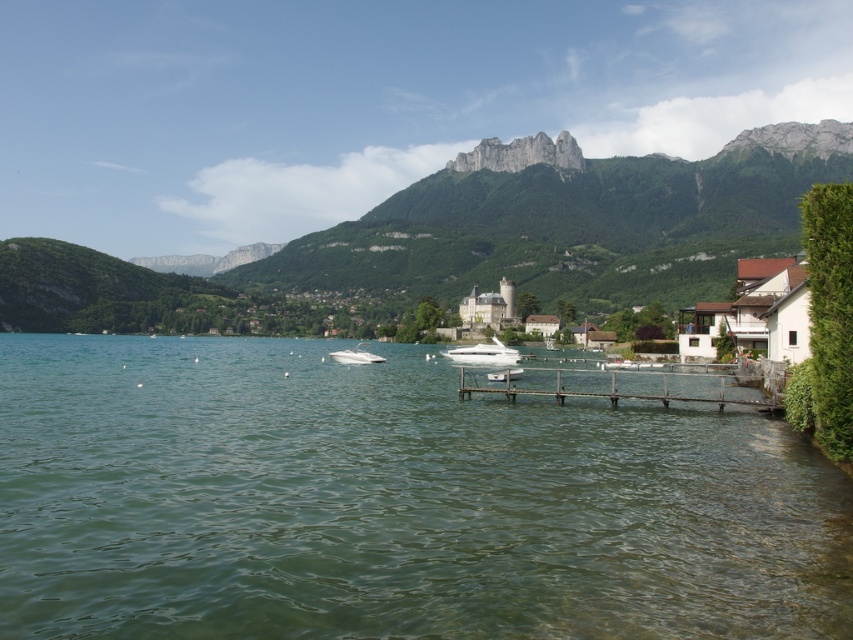
Question: Is the position of green grassy mountain at upper center more distant than that of brown wooden dock at lower center?

Choices:
 (A) no
 (B) yes

Answer: (B)

Question: Does green grassy mountain at upper center appear over white glossy boat at center?

Choices:
 (A) no
 (B) yes

Answer: (B)

Question: Which object is farther from the camera taking this photo?

Choices:
 (A) green grassy mountain at upper center
 (B) white glossy motorboat at center
 (C) white glossy boat at center
 (D) green water at center

Answer: (A)

Question: Is brown wooden dock at lower center thinner than white glossy motorboat at center?

Choices:
 (A) yes
 (B) no

Answer: (B)

Question: Which object is positioned closest to the brown wooden dock at lower center?

Choices:
 (A) green water at center
 (B) white glossy boat at center
 (C) green grassy mountain at upper center

Answer: (A)

Question: Which object is the closest to the brown wooden dock at lower center?

Choices:
 (A) white glossy boat at center
 (B) white glossy motorboat at center
 (C) green grassy mountain at upper center

Answer: (B)